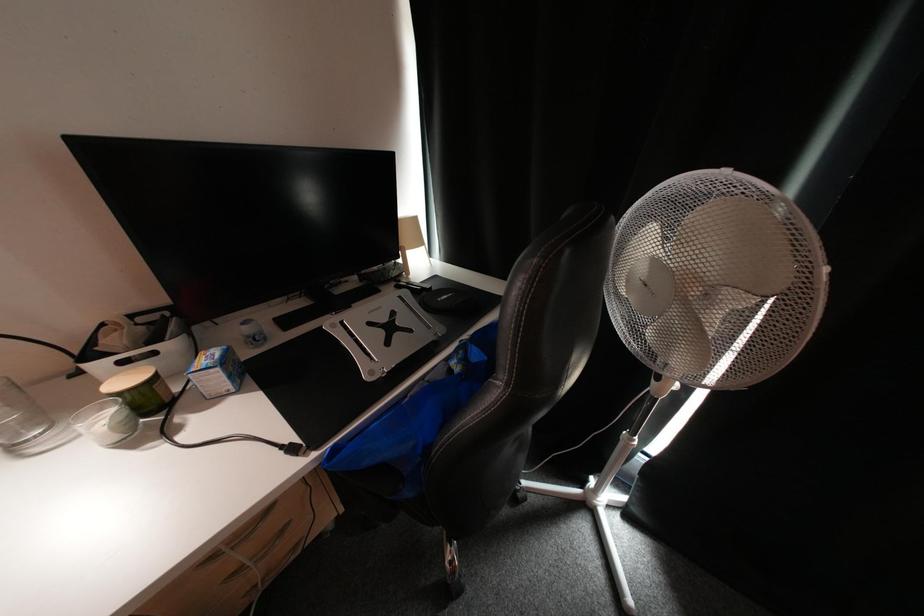
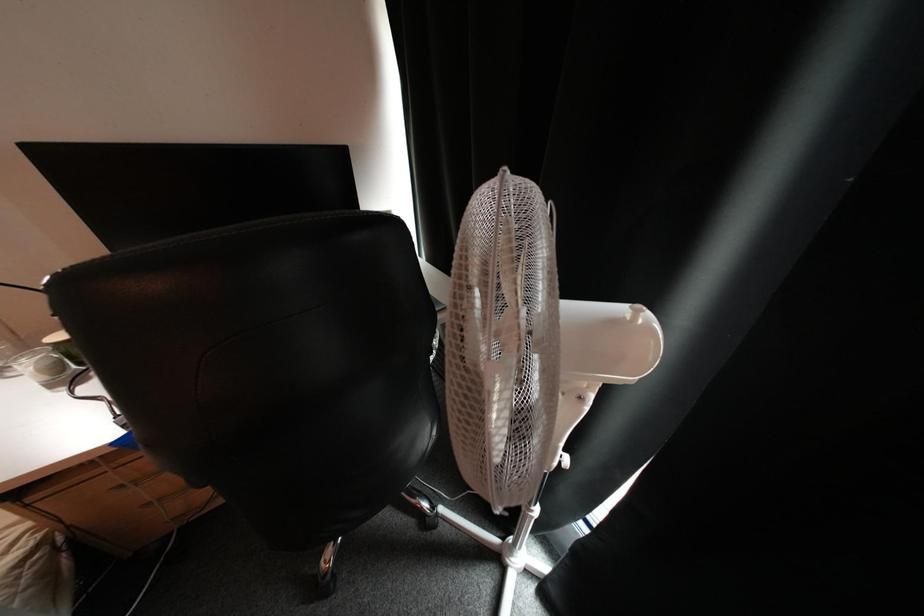
Question: In a continuous first-person perspective shot, in which direction is the camera moving?

Choices:
 (A) Left
 (B) Right
 (C) Forward
 (D) Backward

Answer: (B)